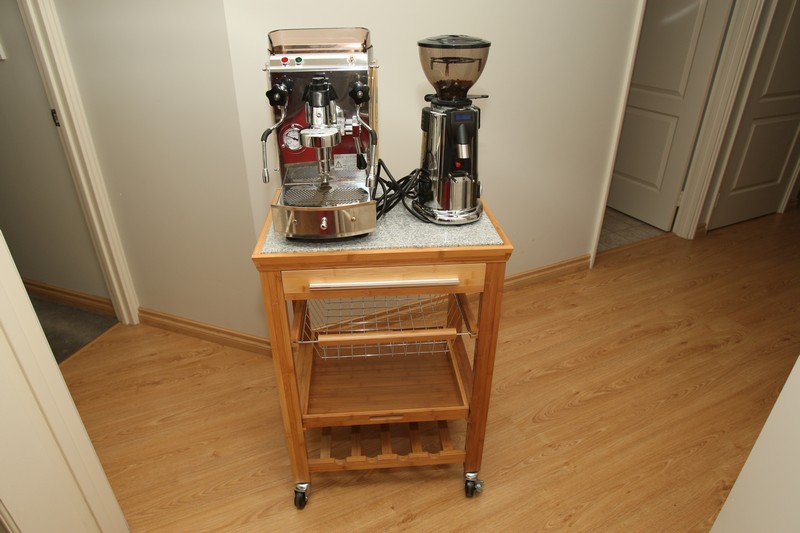
This screenshot has width=800, height=533. Find the location of `right side of expresso machine`. right side of expresso machine is located at coordinates (300, 189).